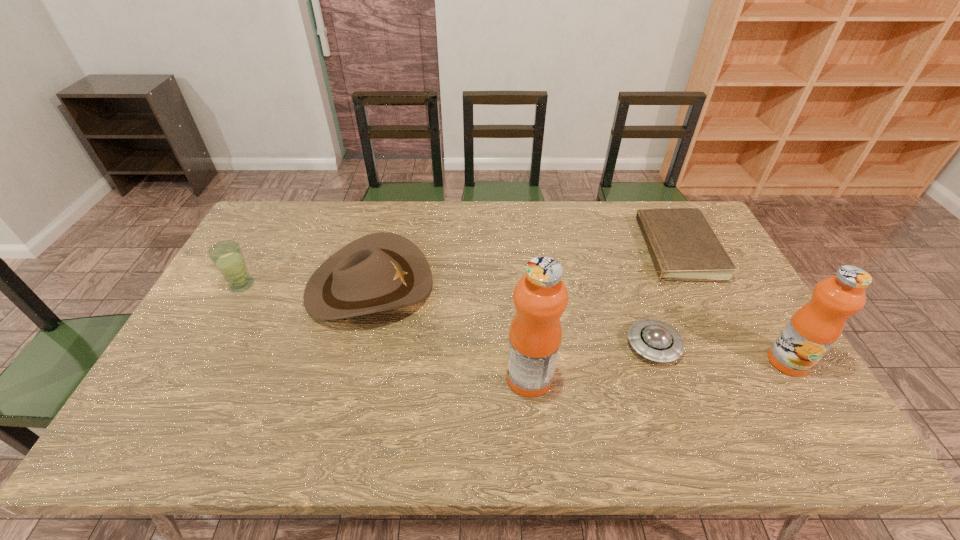
Where is `object at the far right corner`? Image resolution: width=960 pixels, height=540 pixels. object at the far right corner is located at coordinates (683, 246).

This screenshot has width=960, height=540. I want to click on object that is at the near right corner, so point(814,328).

This screenshot has width=960, height=540. Find the location of `free space at the far edge of the desktop`. free space at the far edge of the desktop is located at coordinates (490, 214).

At what (x,y) coordinates should I click in order to perform the action: click on vacant space at the left edge of the desktop. Please return your answer as a coordinate pair (x, y). Looking at the image, I should click on (209, 328).

Identify the location of free space at the right edge. (732, 308).

Locate an element on the screen. This screenshot has width=960, height=540. vacant area at the near right corner of the desktop is located at coordinates (750, 407).

Image resolution: width=960 pixels, height=540 pixels. I want to click on vacant space that is in between the cowboy hat and the tallest object, so click(x=449, y=332).

You are a GUI agent. You are given a task and a screenshot of the screen. Output one action in this format:
    pyautogui.click(x=<x>, y=<y>)
    Task: Click on the free spot between the fifth tallest object and the taller fruit juice
    The image size is (960, 540).
    Given the screenshot: What is the action you would take?
    pyautogui.click(x=591, y=361)

Identify the location of blank region between the cowboy hat and the shorter fruit juice. This screenshot has width=960, height=540. (579, 324).

Locate an element on the screen. unoccupied area between the right fruit juice and the taller fruit juice is located at coordinates (659, 369).